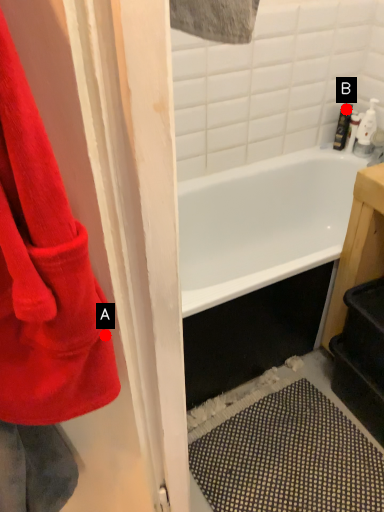
Question: Two points are circled on the image, labeled by A and B beside each circle. Which point is farther from the camera taking this photo?

Choices:
 (A) A is further
 (B) B is further

Answer: (B)